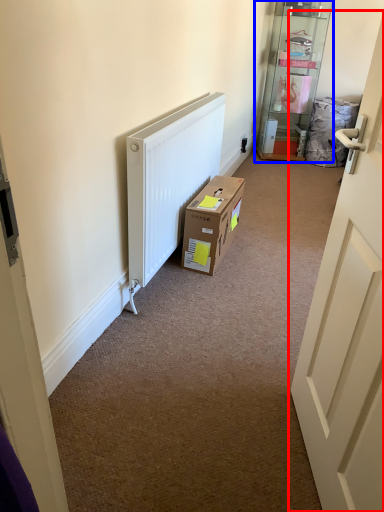
Question: Which point is closer to the camera, door (highlighted by a red box) or shelf (highlighted by a blue box)?

Choices:
 (A) door
 (B) shelf

Answer: (A)